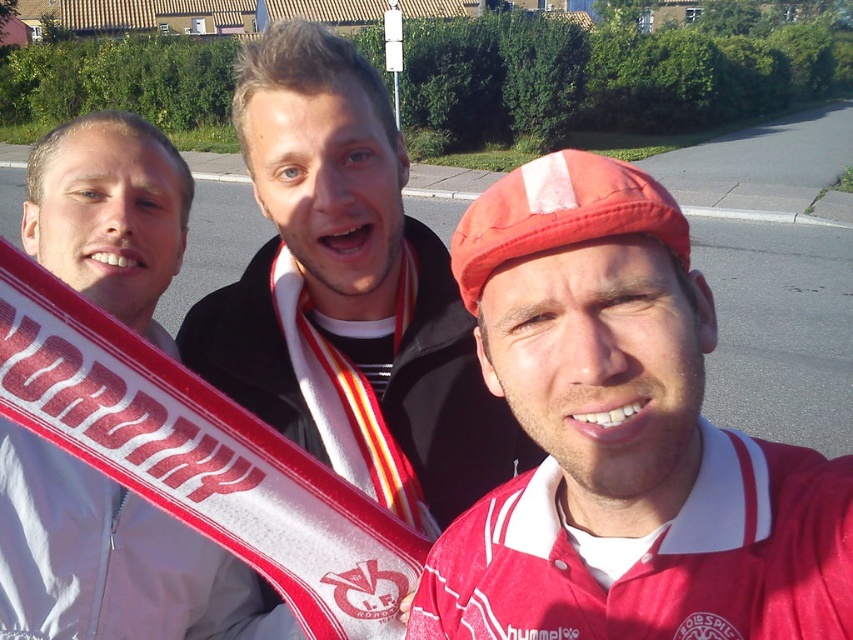
Question: Does matte black jacket at center appear under white fabric scarf at left?

Choices:
 (A) no
 (B) yes

Answer: (A)

Question: Is matte black jacket at center closer to camera compared to white fabric scarf at left?

Choices:
 (A) no
 (B) yes

Answer: (A)

Question: Which object is farther from the camera taking this photo?

Choices:
 (A) matte red cap at center
 (B) white fabric scarf at left
 (C) matte black jacket at center

Answer: (C)

Question: Which object is the farthest from the matte black jacket at center?

Choices:
 (A) white fabric scarf at left
 (B) matte red cap at center

Answer: (B)

Question: Considering the real-world distances, which object is closest to the matte black jacket at center?

Choices:
 (A) matte red cap at center
 (B) white fabric scarf at left

Answer: (B)

Question: In this image, where is matte red cap at center located relative to white fabric scarf at left?

Choices:
 (A) right
 (B) left

Answer: (A)